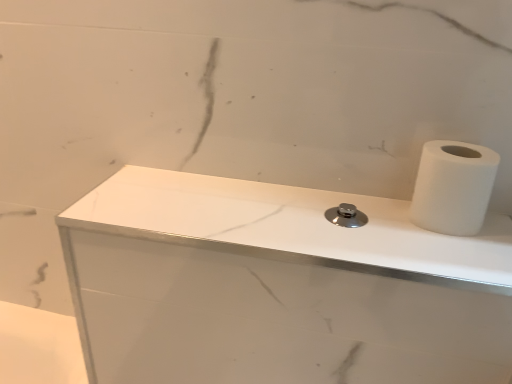
Question: Does white marble counter top at center turn towards white matte paper towel at right?

Choices:
 (A) no
 (B) yes

Answer: (A)

Question: Is white marble counter top at center smaller than white matte paper towel at right?

Choices:
 (A) yes
 (B) no

Answer: (B)

Question: Is white marble counter top at center facing away from white matte paper towel at right?

Choices:
 (A) no
 (B) yes

Answer: (A)

Question: Does white marble counter top at center lie in front of white matte paper towel at right?

Choices:
 (A) no
 (B) yes

Answer: (B)

Question: Is white marble counter top at center positioned behind white matte paper towel at right?

Choices:
 (A) yes
 (B) no

Answer: (B)

Question: Are white marble counter top at center and white matte paper towel at right located far from each other?

Choices:
 (A) no
 (B) yes

Answer: (A)

Question: Considering the relative sizes of white matte paper towel at right and white marble counter top at center in the image provided, is white matte paper towel at right thinner than white marble counter top at center?

Choices:
 (A) yes
 (B) no

Answer: (A)

Question: Does white matte paper towel at right have a greater height compared to white marble counter top at center?

Choices:
 (A) yes
 (B) no

Answer: (B)

Question: Does white matte paper towel at right have a lesser height compared to white marble counter top at center?

Choices:
 (A) no
 (B) yes

Answer: (B)

Question: Is white matte paper towel at right closer to the viewer compared to white marble counter top at center?

Choices:
 (A) yes
 (B) no

Answer: (B)

Question: From a real-world perspective, does white matte paper towel at right sit lower than white marble counter top at center?

Choices:
 (A) no
 (B) yes

Answer: (A)

Question: Considering the relative positions of white matte paper towel at right and white marble counter top at center in the image provided, is white matte paper towel at right to the right of white marble counter top at center from the viewer's perspective?

Choices:
 (A) no
 (B) yes

Answer: (B)

Question: Considering the positions of white marble counter top at center and white matte paper towel at right in the image, is white marble counter top at center taller or shorter than white matte paper towel at right?

Choices:
 (A) short
 (B) tall

Answer: (B)